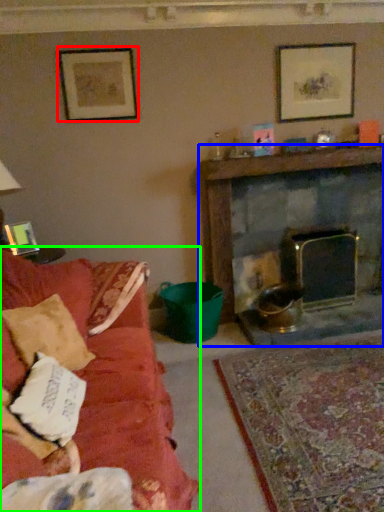
Question: Which is farther away from picture frame (highlighted by a red box)? fireplace (highlighted by a blue box) or studio couch (highlighted by a green box)?

Choices:
 (A) fireplace
 (B) studio couch

Answer: (B)